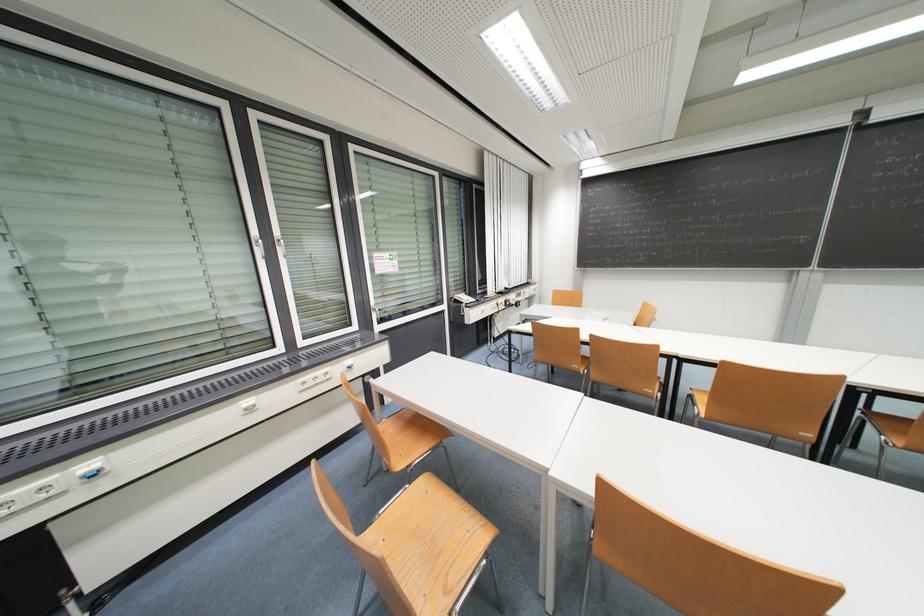
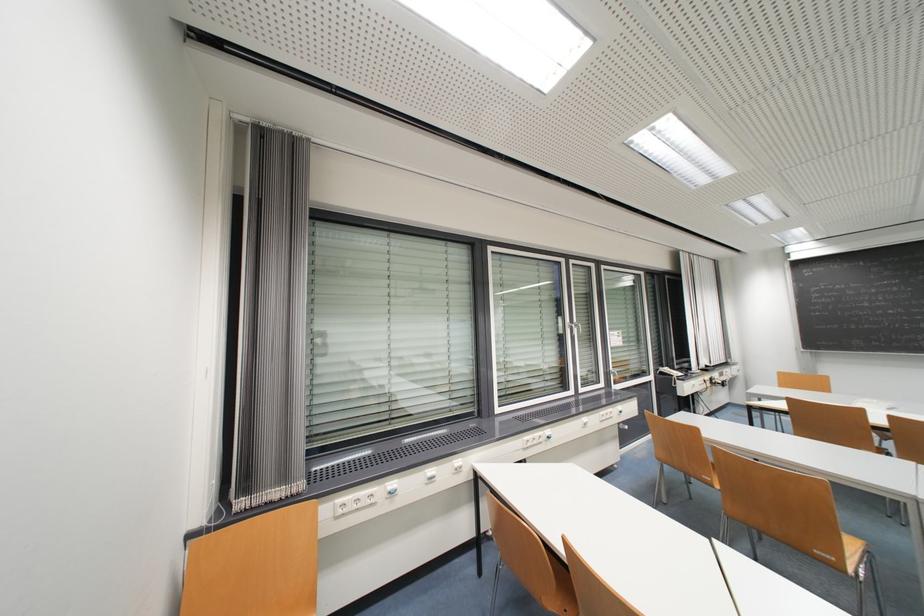
In a continuous first-person perspective shot, in which direction is the camera moving?

The cameraman walked toward left, backward.